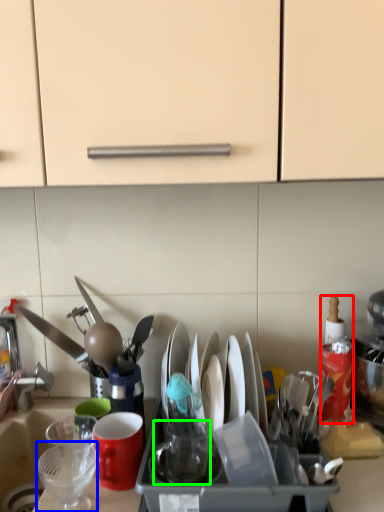
Question: Considering the real-world distances, which object is closest to bottle (highlighted by a red box)? tableware (highlighted by a blue box) or tableware (highlighted by a green box).

Choices:
 (A) tableware
 (B) tableware

Answer: (B)